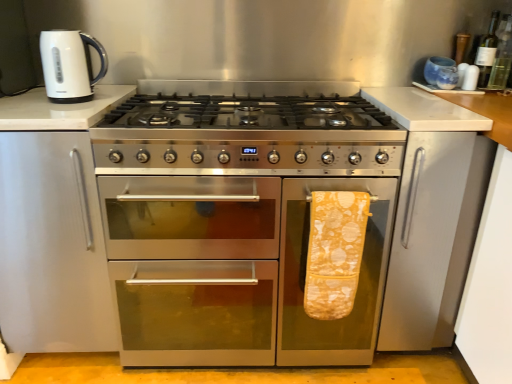
This screenshot has width=512, height=384. Describe the element at coordinates (248, 131) in the screenshot. I see `stainless steel gas stove at center` at that location.

In order to face white glossy electric kettle at upper left, should I rotate leftwards or rightwards?

Turn left approximately 23.184 degrees to face it.

How much space does green glass bottle at upper right, the 1th bottle when ordered from left to right, occupy horizontally?

3.01 inches.

This screenshot has width=512, height=384. I want to click on stainless steel gas stove at center, so click(x=248, y=131).

This screenshot has width=512, height=384. Identify the location of the 1st bottle counting from the right of the stainless steel oven at center. (487, 51).

Is green glass bottle at upper right, which ranks as the 2th bottle in right-to-left order, directly adjacent to stainless steel oven at center?

No, green glass bottle at upper right, which ranks as the 2th bottle in right-to-left order, is not touching stainless steel oven at center.

Which of these two, green glass bottle at upper right, which ranks as the 2th bottle in right-to-left order, or stainless steel oven at center, is thinner?

Thinner between the two is green glass bottle at upper right, which ranks as the 2th bottle in right-to-left order.

Based on the photo, is stainless steel oven at center closer to the viewer compared to white glossy electric kettle at upper left?

Yes, stainless steel oven at center is closer to the camera.

Which of these two, stainless steel oven at center or white glossy electric kettle at upper left, is wider?

With larger width is stainless steel oven at center.

The width and height of the screenshot is (512, 384). Find the location of `oven below the white glossy electric kettle at upper left (from a real-world perspective)`. oven below the white glossy electric kettle at upper left (from a real-world perspective) is located at coordinates (234, 270).

Considering the sizes of objects stainless steel oven at center and yellow printed towel at right in the image provided, who is bigger, stainless steel oven at center or yellow printed towel at right?

stainless steel oven at center is bigger.

Considering the points (378, 310) and (350, 298), which point is behind, point (378, 310) or point (350, 298)?

The point (378, 310) is farther.

Is stainless steel oven at center at the right side of yellow printed towel at right?

No.

Does stainless steel oven at center lie behind yellow printed towel at right?

That is True.

Which is behind, stainless steel gas stove at center or white glossy electric kettle at upper left?

Positioned behind is white glossy electric kettle at upper left.

Could you tell me if stainless steel gas stove at center is turned towards white glossy electric kettle at upper left?

No, stainless steel gas stove at center does not turn towards white glossy electric kettle at upper left.

From a real-world perspective, is stainless steel gas stove at center positioned over white glossy electric kettle at upper left based on gravity?

No, from a real-world perspective, stainless steel gas stove at center is not over white glossy electric kettle at upper left

From the image's perspective, is stainless steel gas stove at center located above or below white glossy electric kettle at upper left?

Clearly, from the image's perspective, stainless steel gas stove at center is below white glossy electric kettle at upper left.

Is green glass bottle at upper right, which ranks as the 2th bottle in right-to-left order, spatially inside white glossy electric kettle at upper left, or outside of it?

The correct answer is: outside.

Between green glass bottle at upper right, the 1th bottle when ordered from left to right, and white glossy electric kettle at upper left, which one has smaller size?

Smaller between the two is green glass bottle at upper right, the 1th bottle when ordered from left to right.

Does green glass bottle at upper right, the 1th bottle when ordered from left to right, have a greater width compared to white glossy electric kettle at upper left?

Incorrect, the width of green glass bottle at upper right, the 1th bottle when ordered from left to right, does not surpass that of white glossy electric kettle at upper left.

Considering the positions of objects stainless steel gas stove at center and stainless steel oven at center in the image provided, who is in front, stainless steel gas stove at center or stainless steel oven at center?

Positioned in front is stainless steel gas stove at center.

Would you consider stainless steel gas stove at center to be distant from stainless steel oven at center?

Actually, stainless steel gas stove at center and stainless steel oven at center are a little close together.

Is point (259, 121) less distant than point (210, 194)?

No, (259, 121) is behind (210, 194).

How far apart are white glossy electric kettle at upper left and stainless steel oven at center?

The distance of white glossy electric kettle at upper left from stainless steel oven at center is 27.72 inches.

Considering the points (45, 44) and (154, 291), which point is behind, point (45, 44) or point (154, 291)?

The point (154, 291) is more distant.

Is white glossy electric kettle at upper left taller or shorter than stainless steel oven at center?

white glossy electric kettle at upper left is shorter than stainless steel oven at center.

The image size is (512, 384). In order to click on oven in front of the green glass bottle at upper right, the 1th bottle when ordered from left to right in this screenshot , I will do `click(234, 270)`.

Where is `kitchen appliance above the stainless steel oven at center (from a real-world perspective)`? kitchen appliance above the stainless steel oven at center (from a real-world perspective) is located at coordinates (69, 65).

Considering their positions, is yellow printed towel at right positioned closer to white glossy electric kettle at upper left than green glass bottle at upper right, placed as the 1th bottle when sorted from right to left?

Based on the image, yellow printed towel at right appears to be nearer to white glossy electric kettle at upper left.

From the picture: Estimate the real-world distances between objects in this image. Which object is further from stainless steel oven at center, green glass bottle at upper right, the 1th bottle when ordered from left to right, or stainless steel gas stove at center?

green glass bottle at upper right, the 1th bottle when ordered from left to right, is further to stainless steel oven at center.

From the image, which object appears to be farther from green glass bottle at upper right, placed as the 1th bottle when sorted from right to left, green glass bottle at upper right, which ranks as the 2th bottle in right-to-left order, or yellow printed towel at right?

yellow printed towel at right is positioned further to the anchor green glass bottle at upper right, placed as the 1th bottle when sorted from right to left.

Looking at the image, which one is located closer to green glass bottle at upper right, the 1th bottle when ordered from left to right, stainless steel oven at center or green glass bottle at upper right, placed as the 1th bottle when sorted from right to left?

green glass bottle at upper right, placed as the 1th bottle when sorted from right to left.

From the image, which object appears to be farther from green glass bottle at upper right, the 1th bottle when ordered from left to right, white glossy electric kettle at upper left or green glass bottle at upper right, placed as the 1th bottle when sorted from right to left?

The object further to green glass bottle at upper right, the 1th bottle when ordered from left to right, is white glossy electric kettle at upper left.

Which object lies nearer to the anchor point green glass bottle at upper right, positioned as the second bottle in left-to-right order, stainless steel gas stove at center or stainless steel oven at center?

stainless steel gas stove at center is closer to green glass bottle at upper right, positioned as the second bottle in left-to-right order.

Estimate the real-world distances between objects in this image. Which object is further from yellow printed towel at right, stainless steel gas stove at center or green glass bottle at upper right, positioned as the second bottle in left-to-right order?

Based on the image, green glass bottle at upper right, positioned as the second bottle in left-to-right order, appears to be further to yellow printed towel at right.

When comparing their distances from yellow printed towel at right, does stainless steel oven at center or green glass bottle at upper right, the 1th bottle when ordered from left to right, seem closer?

Based on the image, stainless steel oven at center appears to be nearer to yellow printed towel at right.

Identify the location of gas stove between stainless steel oven at center and green glass bottle at upper right, positioned as the second bottle in left-to-right order, from left to right. Image resolution: width=512 pixels, height=384 pixels. (248, 131).

The height and width of the screenshot is (384, 512). I want to click on gas stove between stainless steel oven at center and green glass bottle at upper right, which ranks as the 2th bottle in right-to-left order, from left to right, so click(x=248, y=131).

You are a GUI agent. You are given a task and a screenshot of the screen. Output one action in this format:
    pyautogui.click(x=<x>, y=<y>)
    Task: Click on the bath towel between stainless steel oven at center and green glass bottle at upper right, positioned as the second bottle in left-to-right order, from left to right
    
    Given the screenshot: What is the action you would take?
    pyautogui.click(x=334, y=252)

Locate an element on the screen. oven between white glossy electric kettle at upper left and stainless steel gas stove at center in the horizontal direction is located at coordinates (234, 270).